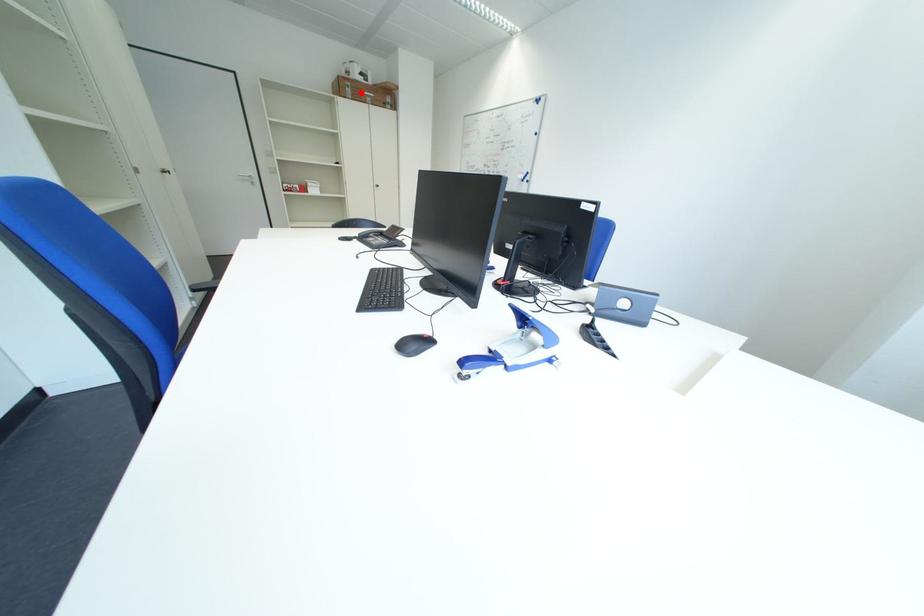
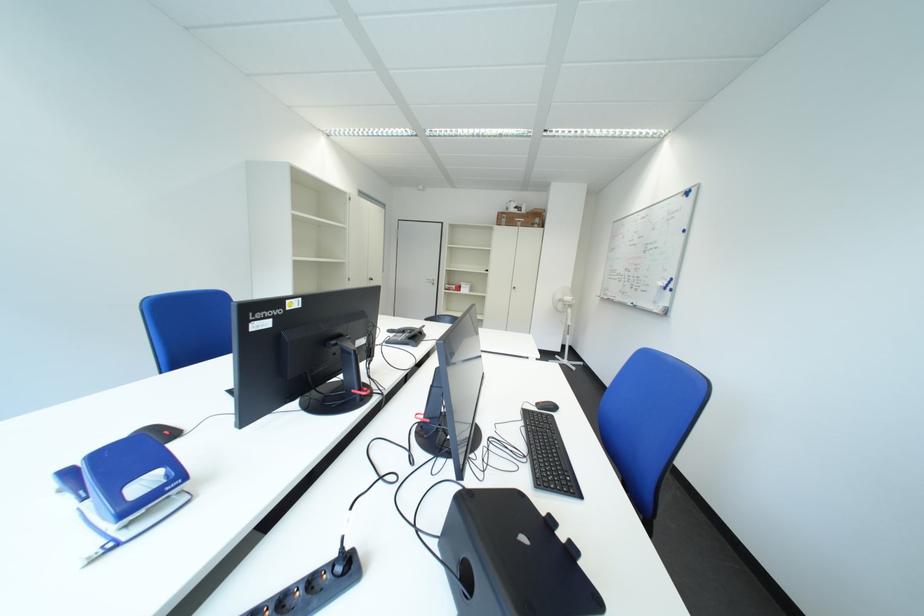
Find the pixel in the second image that matches the highlighted location in the first image.

(517, 223)